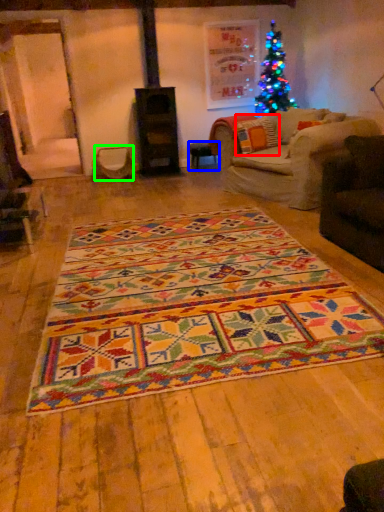
Question: Which object is positioned farthest from pillow (highlighted by a red box)? Select from table (highlighted by a blue box) and swivel chair (highlighted by a green box).

Choices:
 (A) table
 (B) swivel chair

Answer: (B)